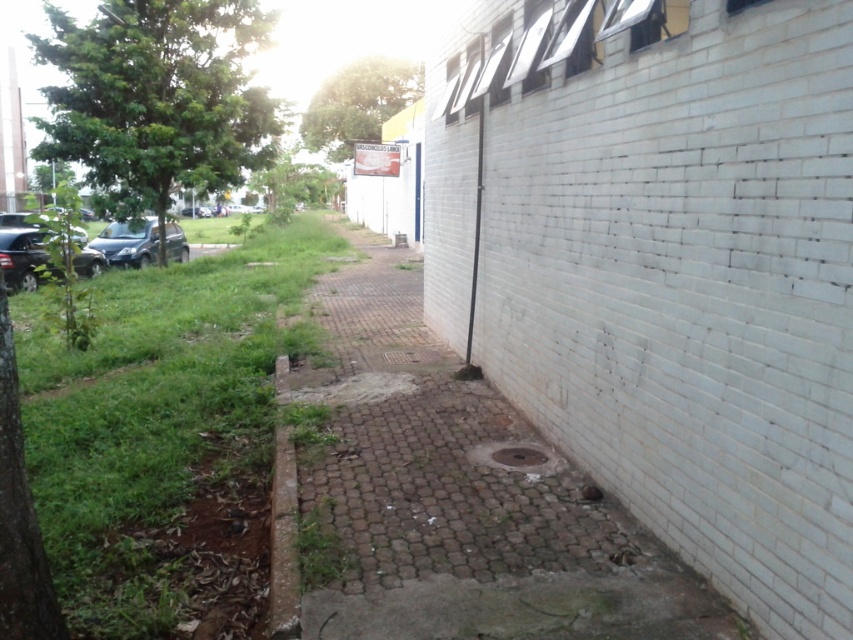
You are standing at the point with coordinates point (543,461) and want to walk towards the white brick wall on the right. Is the point with coordinates point (122,256) in front of or behind you as you face the wall?

The point with coordinates point (122,256) is behind point (543,461), so as you face the wall, the point (122,256) would be behind you.

You are standing in the outdoor scene and need to cross from the white brick wall on the right to the concrete slab at the back. There are green grass at left and a satin black car at left in your path. Which object should you avoid stepping on to stay on solid ground?

You should avoid stepping on the green grass at left because it is wider than the satin black car at left, so the car is narrower and likely on solid ground while the grass might be softer.

You are standing at point [160,422] in the scene. Looking around, you see the white brick wall with windows on the right and the paved area with the manhole cover in front of you. What is directly to your left?

Green grass is directly to your left at point [160,422].